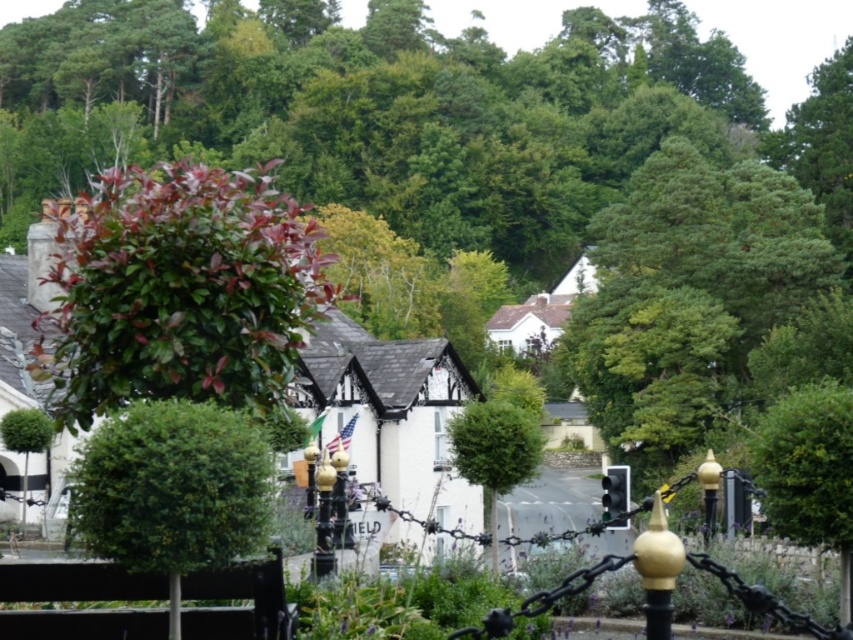
You are a drone operator trying to capture a photo of the green glossy tree at upper left and the green leafy bush at center. Your drone can only fly within a 25 meter radius. Will you be able to capture both subjects in one shot if the drone is positioned between them?

The green glossy tree at upper left is 26.89 meters from the green leafy bush at center. Since the distance exceeds the 25 meter radius, the drone cannot capture both subjects in one shot while staying within its operational limit.

You are a gardener standing in front of the decorative fence. You need to trim both the green glossy tree at upper left and the green leafy bush at center. Which one should you trim first if you want to avoid getting wet from falling leaves?

You should trim the green glossy tree at upper left first because it is positioned over the green leafy bush at center, so trimming the tree first will prevent leaves from falling onto the bush below and getting it wet.